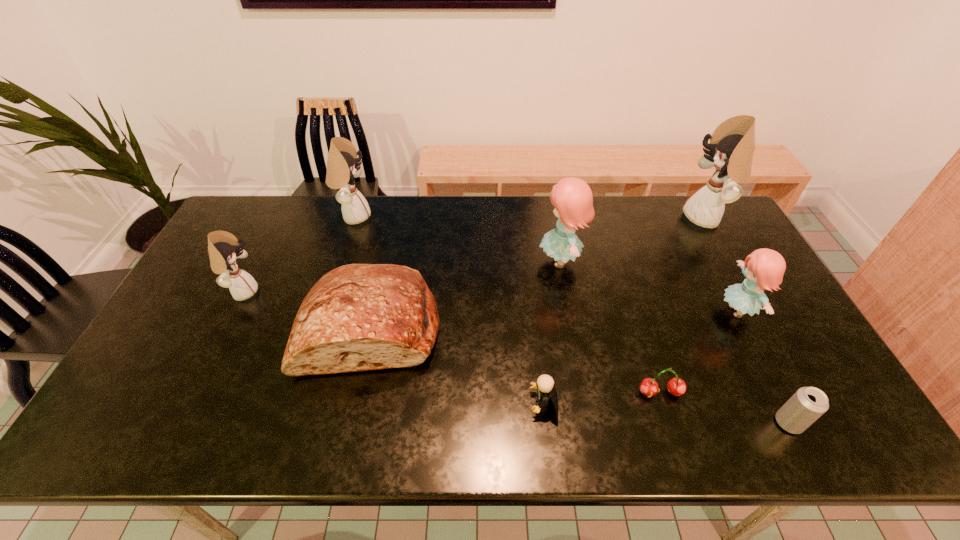
Locate an element on the screen. vacant area situated with stems pointing upwards on the red cherry is located at coordinates (669, 421).

You are a GUI agent. You are given a task and a screenshot of the screen. Output one action in this format:
    pyautogui.click(x=<x>, y=<y>)
    Task: Click on the beer can situated at the near edge
    
    Given the screenshot: What is the action you would take?
    pyautogui.click(x=807, y=404)

The width and height of the screenshot is (960, 540). What are the coordinates of `Lego that is at the near edge` in the screenshot? It's located at (545, 383).

At what (x,y) coordinates should I click in order to perform the action: click on object that is at the left edge. Please return your answer as a coordinate pair (x, y). Looking at the image, I should click on (223, 247).

I want to click on beer can situated at the right edge, so click(x=807, y=404).

At what (x,y) coordinates should I click in order to perform the action: click on object at the far right corner. Please return your answer as a coordinate pair (x, y). The height and width of the screenshot is (540, 960). Looking at the image, I should click on (732, 144).

At what (x,y) coordinates should I click in order to perform the action: click on object situated at the near right corner. Please return your answer as a coordinate pair (x, y). The height and width of the screenshot is (540, 960). Looking at the image, I should click on pyautogui.click(x=807, y=404).

This screenshot has height=540, width=960. I want to click on free space at the far edge of the desktop, so click(x=634, y=199).

In the image, there is a desktop. At what (x,y) coordinates should I click in order to perform the action: click on free region at the near edge. Please return your answer as a coordinate pair (x, y). The image size is (960, 540). Looking at the image, I should click on (601, 429).

This screenshot has width=960, height=540. In order to click on free location at the left edge of the desktop in this screenshot , I will do `click(186, 296)`.